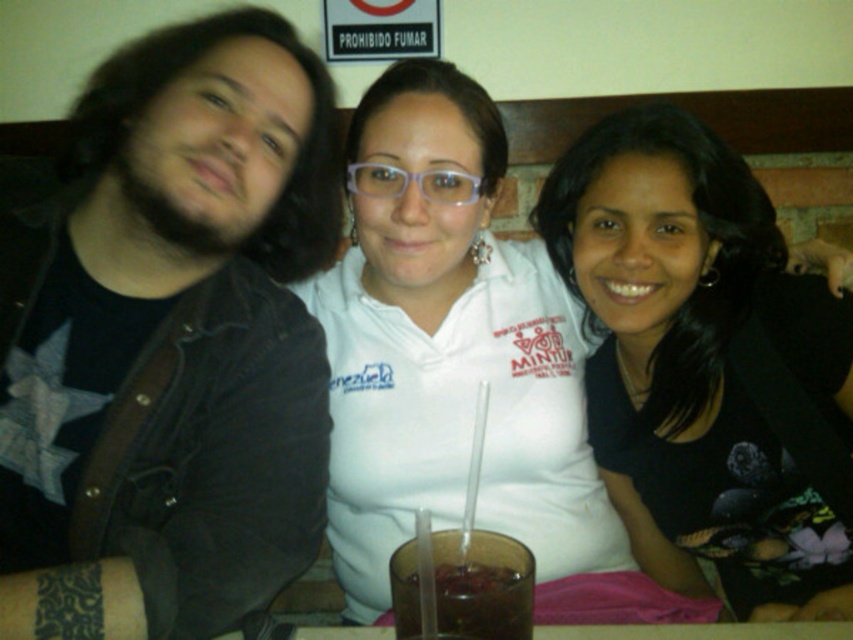
You are a waiter at this restaurant and need to place a dessert plate that is 30 centimeters wide between the dark denim jacket at left and the brown translucent glass at center. Can you fit the plate there?

The dark denim jacket at left is 45.25 centimeters from the brown translucent glass at center. Since the dessert plate is 30 centimeters wide, there is enough space between them to place the plate.

You are a photographer taking a picture of the group. The focus point of your camera is set to coordinates point (701, 362). Which person in the group will be in focus?

The focus point at coordinates point (701, 362) corresponds to the black matte shirt at center, so the person wearing the black matte shirt at center will be in focus.